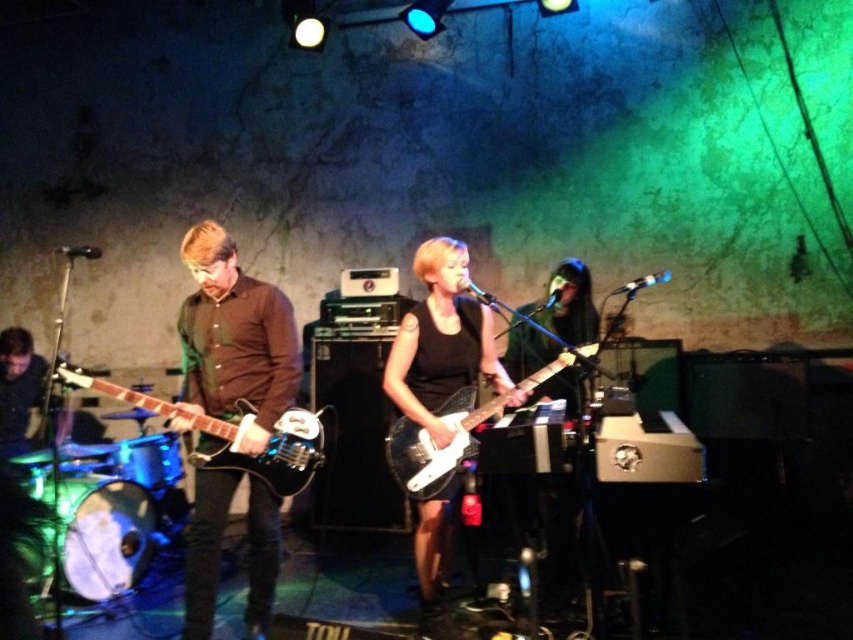
Question: Does matte brown shirt at center appear over glossy black electric guitar at left?

Choices:
 (A) yes
 (B) no

Answer: (B)

Question: Which point is closer to the camera?

Choices:
 (A) (459, 440)
 (B) (454, 323)

Answer: (A)

Question: Which is farther from the glossy black electric guitar at left?

Choices:
 (A) matte brown shirt at center
 (B) white glossy electric guitar at center
 (C) black matte guitar at center

Answer: (C)

Question: Does matte brown shirt at center appear over glossy black electric guitar at left?

Choices:
 (A) no
 (B) yes

Answer: (A)

Question: Considering the real-world distances, which object is closest to the glossy black electric guitar at left?

Choices:
 (A) matte brown shirt at center
 (B) black matte guitar at center

Answer: (A)

Question: Does black matte guitar at center appear over glossy black electric guitar at left?

Choices:
 (A) no
 (B) yes

Answer: (A)